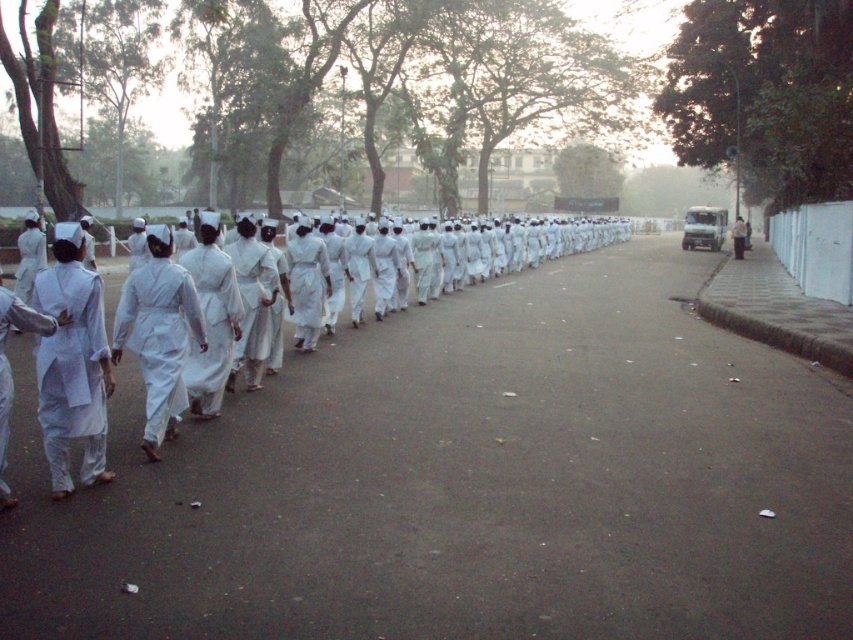
Can you confirm if white cotton dress at left is bigger than white cloth dress at center?

Actually, white cotton dress at left might be smaller than white cloth dress at center.

Describe the element at coordinates (73, 372) in the screenshot. I see `white cotton dress at left` at that location.

You are a GUI agent. You are given a task and a screenshot of the screen. Output one action in this format:
    pyautogui.click(x=<x>, y=<y>)
    Task: Click on the white cotton dress at left
    
    Given the screenshot: What is the action you would take?
    pyautogui.click(x=73, y=372)

Between white matte uniform at left and white cloth dress at center, which one appears on the left side from the viewer's perspective?

Positioned to the left is white matte uniform at left.

Does point (3, 385) come behind point (740, 236)?

No, (3, 385) is closer to viewer.

Is point (3, 428) closer to camera compared to point (735, 252)?

Yes, it is in front of point (735, 252).

Locate an element on the screen. white matte uniform at left is located at coordinates (9, 365).

Is point (508, 253) positioned in front of point (154, 355)?

That is False.

What do you see at coordinates (186, 326) in the screenshot? Image resolution: width=853 pixels, height=640 pixels. I see `white cloth uniform at center` at bounding box center [186, 326].

Where is `white cloth uniform at center`? white cloth uniform at center is located at coordinates (186, 326).